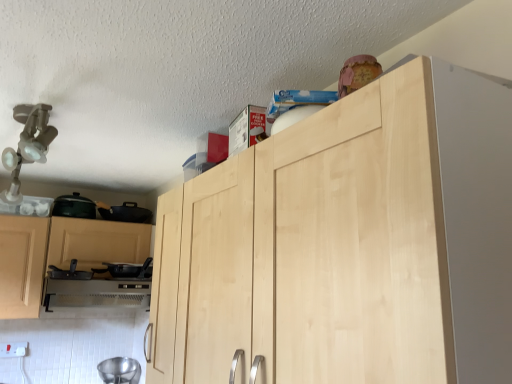
Question: Should I look upward or downward to see white plastic electric outlet at lower left?

Choices:
 (A) down
 (B) up

Answer: (A)

Question: Are black matte pan at lower left, the third appliance from the top, and white plastic electric outlet at lower left far apart?

Choices:
 (A) yes
 (B) no

Answer: (B)

Question: Can you confirm if black matte pan at lower left, the second appliance from the bottom, is thinner than white plastic electric outlet at lower left?

Choices:
 (A) yes
 (B) no

Answer: (B)

Question: Is white plastic electric outlet at lower left inside black matte pan at lower left, the third appliance from the top?

Choices:
 (A) yes
 (B) no

Answer: (B)

Question: From a real-world perspective, is black matte pan at lower left, the second appliance from the bottom, physically below white plastic electric outlet at lower left?

Choices:
 (A) yes
 (B) no

Answer: (B)

Question: Does black matte pan at lower left, the second appliance from the bottom, have a greater width compared to white plastic electric outlet at lower left?

Choices:
 (A) no
 (B) yes

Answer: (B)

Question: Does black matte pan at lower left, the third appliance from the top, have a greater height compared to white plastic electric outlet at lower left?

Choices:
 (A) yes
 (B) no

Answer: (A)

Question: Can you confirm if natural wood cabinet at upper center is wider than satin silver oven at lower left?

Choices:
 (A) no
 (B) yes

Answer: (A)

Question: Is natural wood cabinet at upper center taller than satin silver oven at lower left?

Choices:
 (A) yes
 (B) no

Answer: (A)

Question: Is natural wood cabinet at upper center oriented towards satin silver oven at lower left?

Choices:
 (A) no
 (B) yes

Answer: (A)

Question: Is natural wood cabinet at upper center directly adjacent to satin silver oven at lower left?

Choices:
 (A) no
 (B) yes

Answer: (A)

Question: Does natural wood cabinet at upper center appear on the right side of satin silver oven at lower left?

Choices:
 (A) no
 (B) yes

Answer: (B)

Question: Considering the relative positions of natural wood cabinet at upper center and satin silver oven at lower left in the image provided, is natural wood cabinet at upper center behind satin silver oven at lower left?

Choices:
 (A) yes
 (B) no

Answer: (B)

Question: Considering the relative sizes of natural wood cabinet at upper center and metallic silver bowl at lower left, which appears as the 1th appliance when ordered from the bottom, in the image provided, is natural wood cabinet at upper center smaller than metallic silver bowl at lower left, which appears as the 1th appliance when ordered from the bottom,?

Choices:
 (A) no
 (B) yes

Answer: (A)